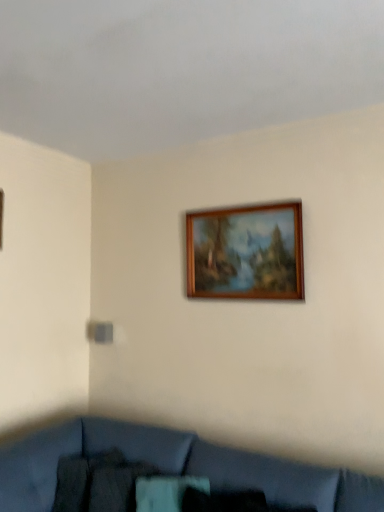
Question: In the image, is wooden picture frame at upper center positioned in front of or behind velvet blue couch at lower center?

Choices:
 (A) behind
 (B) front

Answer: (A)

Question: From the image's perspective, is wooden picture frame at upper center above or below velvet blue couch at lower center?

Choices:
 (A) above
 (B) below

Answer: (A)

Question: In the image, is wooden picture frame at upper center on the left side or the right side of velvet blue couch at lower center?

Choices:
 (A) left
 (B) right

Answer: (B)

Question: Based on their sizes in the image, would you say velvet blue couch at lower center is bigger or smaller than wooden picture frame at upper center?

Choices:
 (A) small
 (B) big

Answer: (B)

Question: From their relative heights in the image, would you say velvet blue couch at lower center is taller or shorter than wooden picture frame at upper center?

Choices:
 (A) short
 (B) tall

Answer: (B)

Question: Is velvet blue couch at lower center to the left or to the right of wooden picture frame at upper center in the image?

Choices:
 (A) left
 (B) right

Answer: (A)

Question: From a real-world perspective, relative to wooden picture frame at upper center, is velvet blue couch at lower center vertically above or below?

Choices:
 (A) below
 (B) above

Answer: (A)